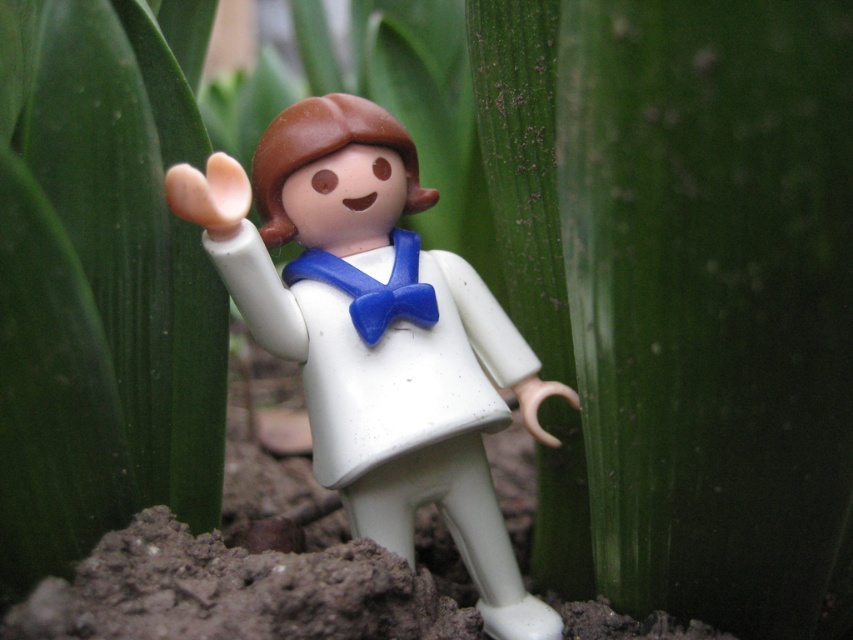
You are a child who wants to play with the white plastic toy at center and the blue plastic bow tie at center. Which one do you think you can hold in your hand more easily?

The blue plastic bow tie at center is smaller in size than the white plastic toy at center, so it can be held more easily.

You are a toy collector examining the figurine and notice the green matte leaf at center and the blue plastic bow tie at center. Which object is wider?

The green matte leaf at center is wider than the blue plastic bow tie at center.

You are a child trying to fit the blue plastic bow tie at center into a small box that can only hold items narrower than the white plastic toy at center. Will the bow tie fit?

The blue plastic bow tie at center is narrower than the white plastic toy at center, so it will fit into the box.